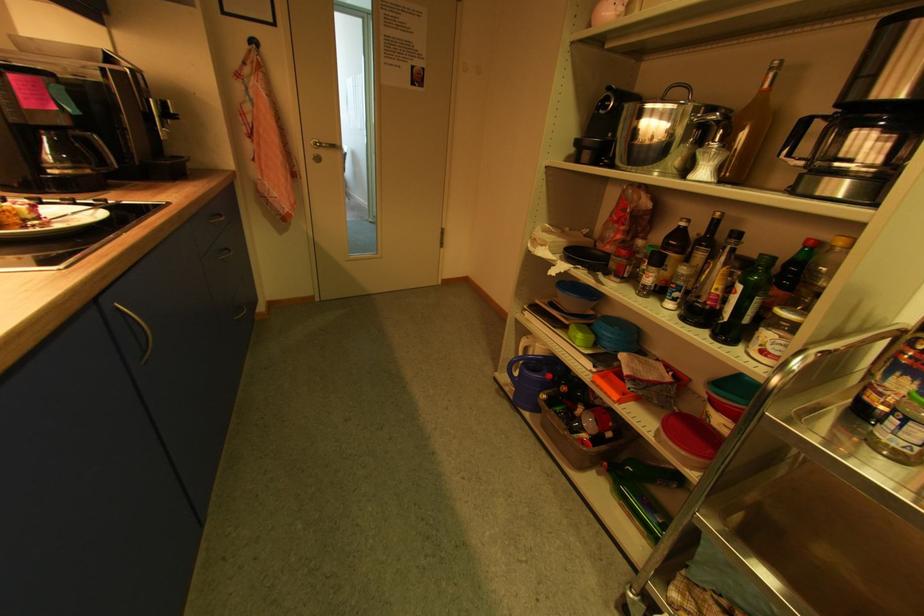
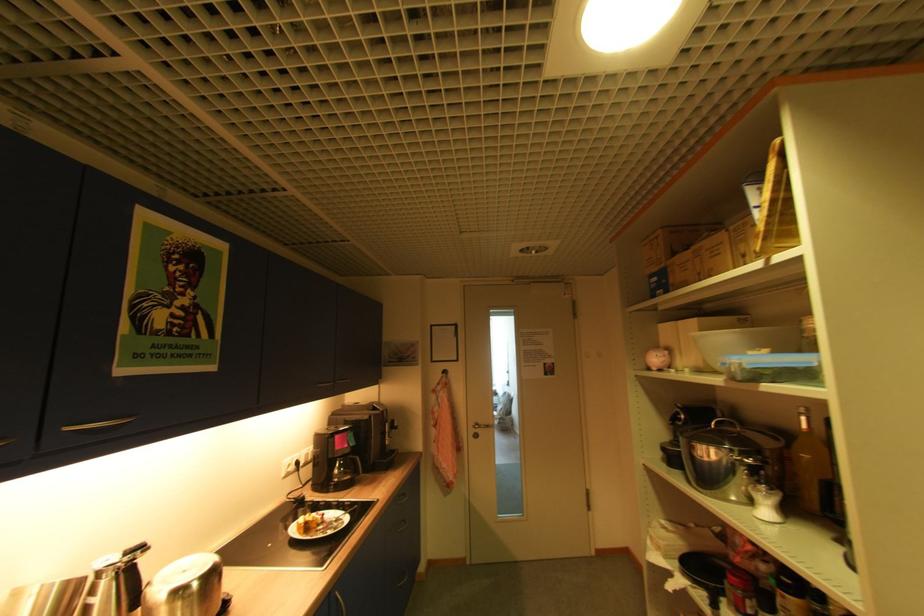
In the second image, find the point that corresponds to point 772,87 in the first image.

(809, 428)